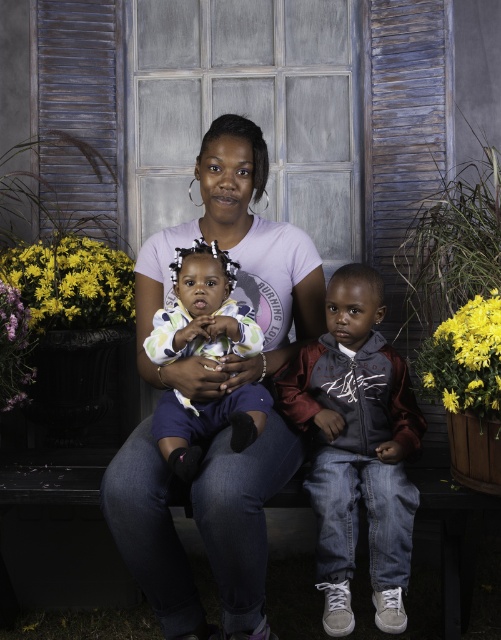
You are a photographer setting up for a family portrait. You need to position a velvet maroon hoodie at center and yellow matte flowers at left. Given that the space between them must be exactly 1.20 meters, will you be able to place them correctly if your available space is 1.20 meters wide?

Yes, the distance between the velvet maroon hoodie at center and yellow matte flowers at left is exactly 1.20 meters, which matches the available space. Therefore, they can be placed correctly.